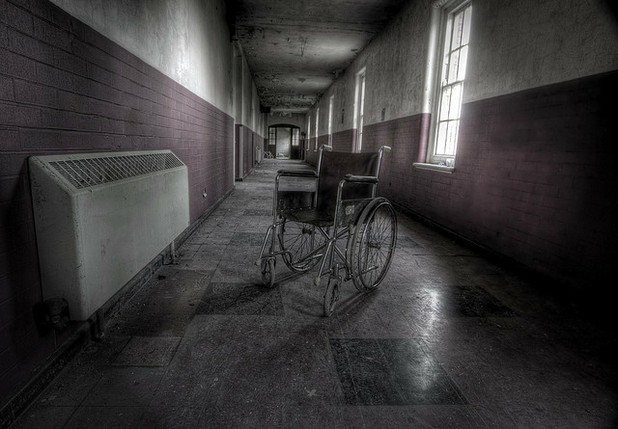
Find the location of `radiator sompression fitting`. radiator sompression fitting is located at coordinates (51, 316).